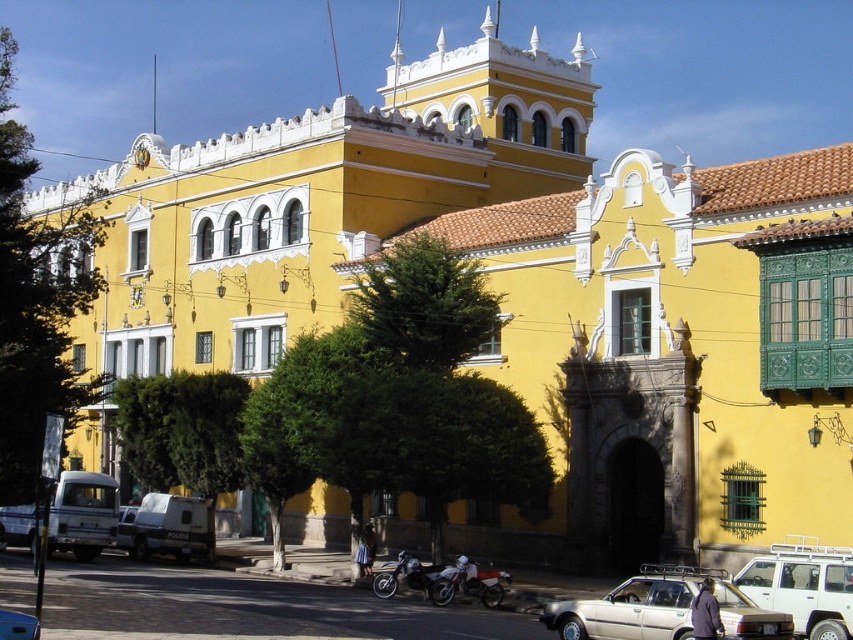
You are standing in front of the yellow colonial building and need to park your white matte van at center. The parking spot is located at coordinate point 0.825, 0.193. Can you confirm if the van is already parked in the correct spot?

Yes, the white matte van at center is already parked at the correct coordinate point (164, 528) as specified.

You are a delivery person who needs to park your vehicle in the parking lot behind the yellow colonial building. The entrance has a height restriction of 2 meters. You have a white matte van at center and a white matte motorcycle at center. Which vehicle can safely pass under the entrance without hitting the height restriction?

The white matte motorcycle at center can safely pass under the entrance without hitting the height restriction because it has a lesser height compared to the white matte van at center, which exceeds the 2 meters limit.